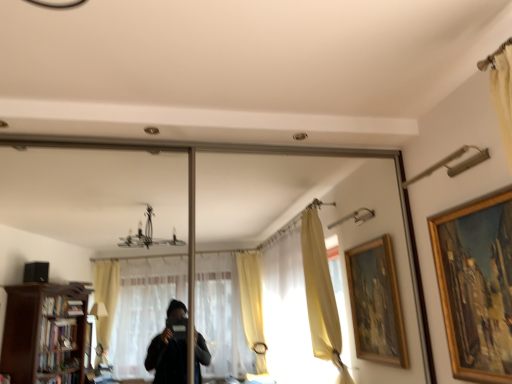
Measure the distance between gold-framed painting at right and camera.

The distance of gold-framed painting at right from camera is 1.62 meters.

Looking at this image, what is the approximate height of gold-framed painting at right?

It is 75.93 centimeters.

Locate an element on the screen. gold-framed painting at right is located at coordinates (476, 285).

What do you see at coordinates (476, 285) in the screenshot? I see `gold-framed painting at right` at bounding box center [476, 285].

This screenshot has height=384, width=512. Find the location of `gold-framed painting at right`. gold-framed painting at right is located at coordinates (476, 285).